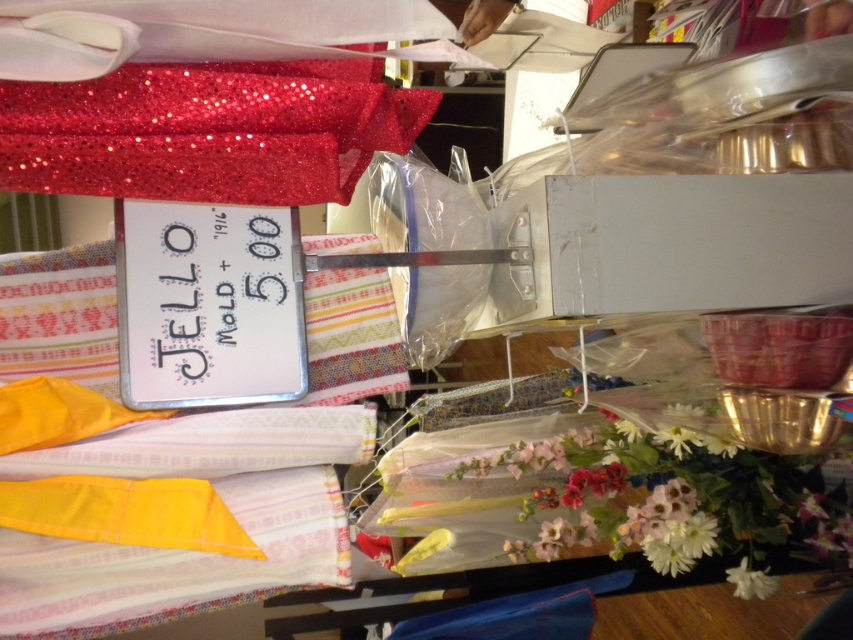
Does glittery red fabric at upper left have a larger size compared to white fabric flower at lower right?

Correct, glittery red fabric at upper left is larger in size than white fabric flower at lower right.

Is glittery red fabric at upper left to the left of white fabric flower at lower right from the viewer's perspective?

Indeed, glittery red fabric at upper left is positioned on the left side of white fabric flower at lower right.

Identify the location of glittery red fabric at upper left. (202, 134).

Does glittery red fabric at upper left appear over white matte flower at lower right?

Indeed, glittery red fabric at upper left is positioned over white matte flower at lower right.

Does glittery red fabric at upper left come in front of white matte flower at lower right?

Yes.

Is point (186, 96) positioned before point (677, 552)?

Yes, point (186, 96) is closer to viewer.

Locate an element on the screen. glittery red fabric at upper left is located at coordinates (202, 134).

Can you confirm if white matte flower at lower right is thinner than white fabric flower at lower right?

No, white matte flower at lower right is not thinner than white fabric flower at lower right.

Based on the photo, is white matte flower at lower right smaller than white fabric flower at lower right?

No.

Which is in front, point (654, 509) or point (741, 564)?

Point (654, 509) is in front.

Find the location of `white matte flower at lower right`. white matte flower at lower right is located at coordinates (668, 529).